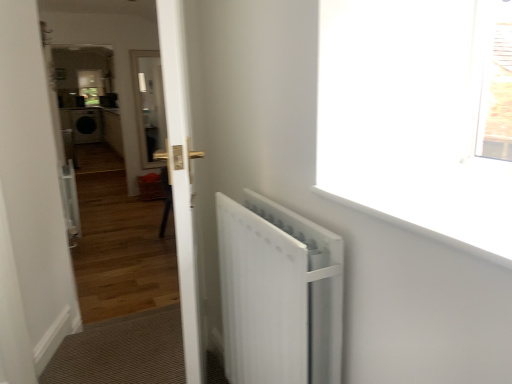
The image size is (512, 384). Identify the location of white glossy door at center. (181, 180).

Measure the distance between point (127, 298) and camera.

The distance of point (127, 298) from camera is 2.84 meters.

At what (x,y) coordinates should I click in order to perform the action: click on white smooth window sill at upper right. Please return your answer as a coordinate pair (x, y). Image resolution: width=512 pixels, height=384 pixels. Looking at the image, I should click on (417, 228).

Image resolution: width=512 pixels, height=384 pixels. I want to click on white glossy door at center, so click(x=181, y=180).

Considering the sizes of white matte radiator at right and white glossy door at center in the image, is white matte radiator at right bigger or smaller than white glossy door at center?

Considering their sizes, white matte radiator at right takes up less space than white glossy door at center.

In the image, is white matte radiator at right positioned in front of or behind white glossy door at center?

In the image, white matte radiator at right appears in front of white glossy door at center.

From a real-world perspective, is white matte radiator at right on white glossy door at center?

No.

How different are the orientations of white matte radiator at right and white glossy door at center in degrees?

19.3 degrees.

Can you tell me how much white glossy door at center and white glossy door at center differ in facing direction?

The angular difference between white glossy door at center and white glossy door at center is 109 degrees.

From a real-world perspective, is white glossy door at center on white glossy door at center?

Incorrect, from a real-world perspective, white glossy door at center is lower than white glossy door at center.

Who is shorter, white glossy door at center or white glossy door at center?

white glossy door at center is shorter.

Which is in front, point (181, 146) or point (112, 285)?

Positioned in front is point (181, 146).

How distant is white smooth window sill at upper right from white matte radiator at right?

white smooth window sill at upper right and white matte radiator at right are 12.38 inches apart from each other.

Which of these two, white smooth window sill at upper right or white matte radiator at right, is smaller?

white smooth window sill at upper right.

Is white smooth window sill at upper right next to white matte radiator at right?

white smooth window sill at upper right and white matte radiator at right are not in contact.

Does white smooth window sill at upper right have a lesser height compared to white matte radiator at right?

Indeed, white smooth window sill at upper right has a lesser height compared to white matte radiator at right.

Does white smooth window sill at upper right turn towards white glossy door at center?

No, white smooth window sill at upper right is not facing towards white glossy door at center.

There is a white glossy door at center. Where is `window sill above it (from a real-world perspective)`? window sill above it (from a real-world perspective) is located at coordinates (417, 228).

Is white smooth window sill at upper right placed right next to white glossy door at center?

No.

Looking at this image, in terms of size, does white smooth window sill at upper right appear bigger or smaller than white glossy door at center?

Considering their sizes, white smooth window sill at upper right takes up less space than white glossy door at center.

Between white glossy door at center and white matte radiator at right, which one is positioned behind?

white glossy door at center is behind.

From a real-world perspective, who is located lower, white glossy door at center or white matte radiator at right?

white matte radiator at right is physically lower.

Is white glossy door at center smaller than white matte radiator at right?

Correct, white glossy door at center occupies less space than white matte radiator at right.

Does white glossy door at center turn towards white matte radiator at right?

Yes, white glossy door at center is aimed at white matte radiator at right.

Is point (163, 269) in front of point (313, 187)?

No, it is not.

How distant is white glossy door at center from white smooth window sill at upper right?

A distance of 37.78 feet exists between white glossy door at center and white smooth window sill at upper right.

Is white glossy door at center positioned before white smooth window sill at upper right?

That is False.

From the image's perspective, is white glossy door at center below white smooth window sill at upper right?

Indeed, from the image's perspective, white glossy door at center is shown beneath white smooth window sill at upper right.

Are white glossy door at center and white glossy door at center making contact?

They are not placed beside each other.

Find the location of `door on the right side of white glossy door at center`. door on the right side of white glossy door at center is located at coordinates (181, 180).

Does white glossy door at center have a greater width compared to white glossy door at center?

In fact, white glossy door at center might be narrower than white glossy door at center.

Considering the sizes of objects white glossy door at center and white glossy door at center in the image provided, who is shorter, white glossy door at center or white glossy door at center?

With less height is white glossy door at center.

Image resolution: width=512 pixels, height=384 pixels. What are the coordinates of `radiator lying below the white glossy door at center (from the image's perspective)` in the screenshot? It's located at (278, 294).

Locate an element on the screen. This screenshot has height=384, width=512. corridor that appears above the white glossy door at center (from the image's perspective) is located at coordinates (113, 173).

From the picture: Based on their spatial positions, is white matte radiator at right or white glossy door at center further from white glossy door at center?

The object further to white glossy door at center is white matte radiator at right.

Estimate the real-world distances between objects in this image. Which object is further from white glossy door at center, white glossy door at center or white smooth window sill at upper right?

white glossy door at center lies further to white glossy door at center than the other object.

Looking at the image, which one is located further to white matte radiator at right, white glossy door at center or white smooth window sill at upper right?

Among the two, white smooth window sill at upper right is located further to white matte radiator at right.

Considering their positions, is white matte radiator at right positioned further to white glossy door at center than white smooth window sill at upper right?

The object further to white glossy door at center is white smooth window sill at upper right.

Estimate the real-world distances between objects in this image. Which object is closer to white matte radiator at right, white smooth window sill at upper right or white glossy door at center?

Among the two, white smooth window sill at upper right is located nearer to white matte radiator at right.

Based on their spatial positions, is white glossy door at center or white glossy door at center further from white smooth window sill at upper right?

Among the two, white glossy door at center is located further to white smooth window sill at upper right.

Estimate the real-world distances between objects in this image. Which object is further from white matte radiator at right, white glossy door at center or white glossy door at center?

The object further to white matte radiator at right is white glossy door at center.

Which object lies further to the anchor point white matte radiator at right, white glossy door at center or white glossy door at center?

white glossy door at center is further to white matte radiator at right.

Where is `radiator between white glossy door at center and white smooth window sill at upper right from left to right`? The width and height of the screenshot is (512, 384). radiator between white glossy door at center and white smooth window sill at upper right from left to right is located at coordinates (278, 294).

Locate an element on the screen. radiator between white glossy door at center and white smooth window sill at upper right is located at coordinates (278, 294).

Where is `door located between white glossy door at center and white smooth window sill at upper right in the left-right direction`? This screenshot has width=512, height=384. door located between white glossy door at center and white smooth window sill at upper right in the left-right direction is located at coordinates (181, 180).

The height and width of the screenshot is (384, 512). In order to click on door situated between white glossy door at center and white matte radiator at right from left to right in this screenshot , I will do `click(181, 180)`.